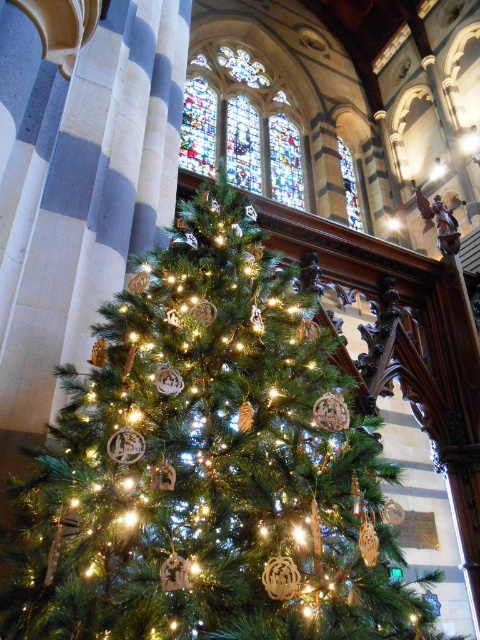
Measure the distance between point (385, 502) and camera.

Point (385, 502) and camera are 72.85 feet apart.

Where is `green matte christmas tree at center`? green matte christmas tree at center is located at coordinates (208, 465).